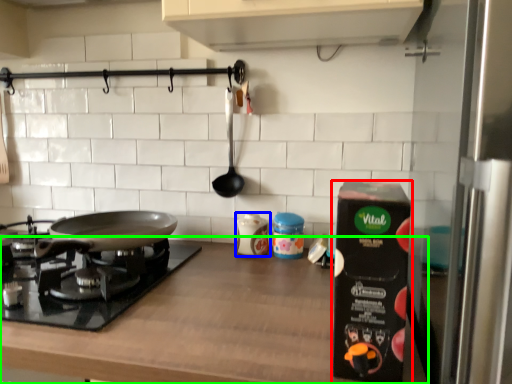
Question: Which object is the farthest from kitchen appliance (highlighted by a red box)? Choose among these: kitchen appliance (highlighted by a blue box) or countertop (highlighted by a green box).

Choices:
 (A) kitchen appliance
 (B) countertop

Answer: (A)